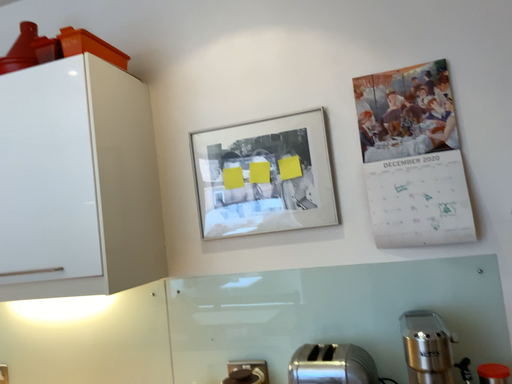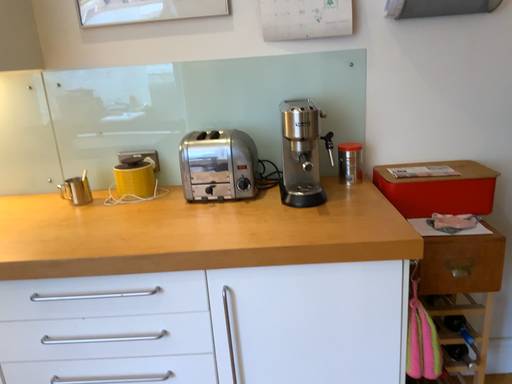
Question: How did the camera likely rotate when shooting the video?

Choices:
 (A) rotated right
 (B) rotated left

Answer: (A)